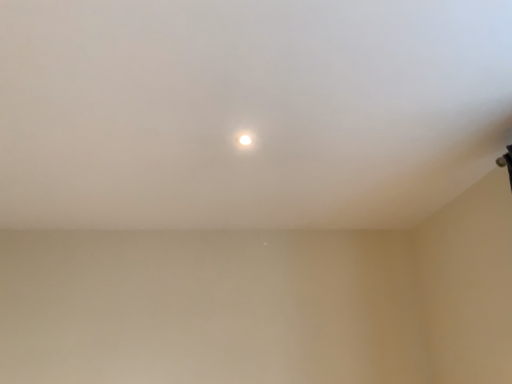
Image resolution: width=512 pixels, height=384 pixels. Find the location of `white glossy light fixture at center`. white glossy light fixture at center is located at coordinates (245, 140).

This screenshot has height=384, width=512. Describe the element at coordinates (245, 140) in the screenshot. I see `white glossy light fixture at center` at that location.

The width and height of the screenshot is (512, 384). In order to click on white glossy light fixture at center in this screenshot , I will do `click(245, 140)`.